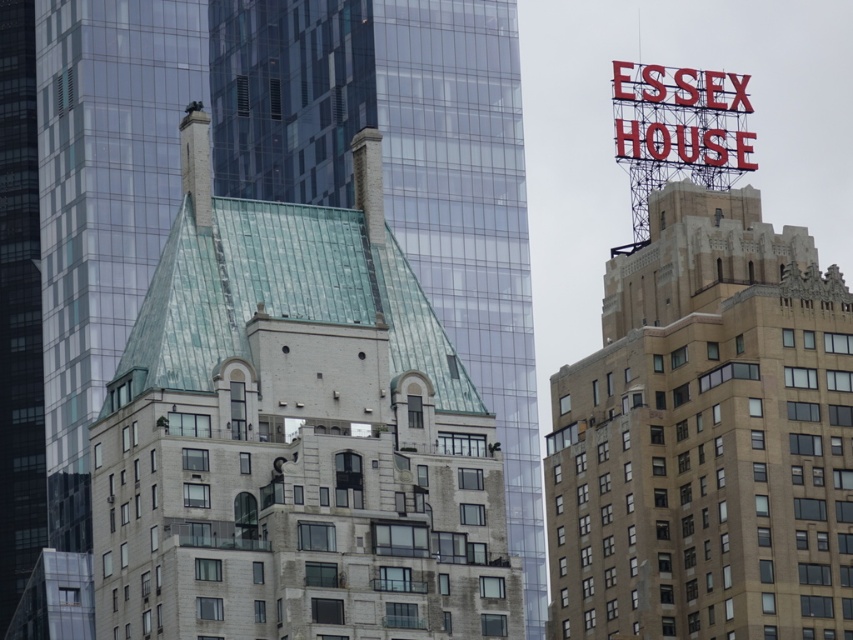
You are a drone operator tasked with flying a drone from the white brick building at center to the beige stone building at upper right. The drone has a maximum flight range of 25 meters. Based on the cityscape described, will the drone be able to reach its destination without needing to recharge?

The distance between the white brick building at center and the beige stone building at upper right is 26.09 meters. Since the drone can only fly 25 meters before needing to recharge, it will not be able to reach the beige stone building at upper right without recharging.

Consider the image. What is the color of the building located at the coordinates point [294,436]?

The point [294,436] marks the white brick building at center, which is white in color.

You are a city planner analyzing the layout of the buildings. Based on the provided image, which of the two buildings, the white brick building at center or the beige stone building at upper right, has a smaller footprint in the city layout?

The white brick building at center occupies less space than the beige stone building at upper right, so the white brick building at center has a smaller footprint in the city layout.